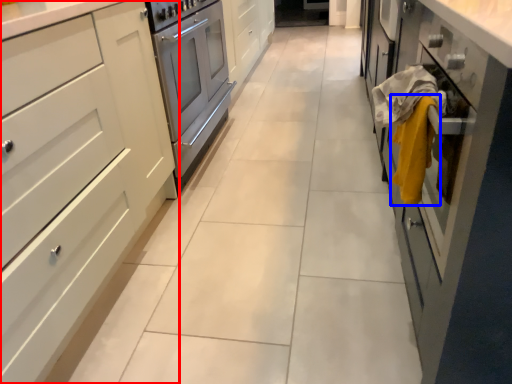
Question: Which object is closer to the camera taking this photo, cabinetry (highlighted by a red box) or blanket (highlighted by a blue box)?

Choices:
 (A) cabinetry
 (B) blanket

Answer: (A)